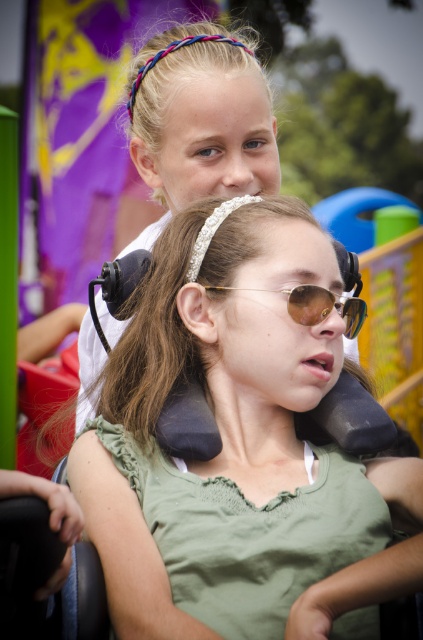
Question: Which point appears closest to the camera in this image?

Choices:
 (A) (357, 320)
 (B) (252, 304)

Answer: (B)

Question: Among these points, which one is nearest to the camera?

Choices:
 (A) (364, 317)
 (B) (277, 564)

Answer: (B)

Question: Which object is closer to the camera taking this photo?

Choices:
 (A) green matte shirt at center
 (B) gold reflective sunglasses at center

Answer: (A)

Question: Is green matte shirt at center behind gold reflective sunglasses at center?

Choices:
 (A) yes
 (B) no

Answer: (B)

Question: Can you confirm if green matte shirt at center is wider than gold reflective sunglasses at center?

Choices:
 (A) yes
 (B) no

Answer: (A)

Question: Does green matte shirt at center have a greater width compared to gold reflective sunglasses at center?

Choices:
 (A) no
 (B) yes

Answer: (B)